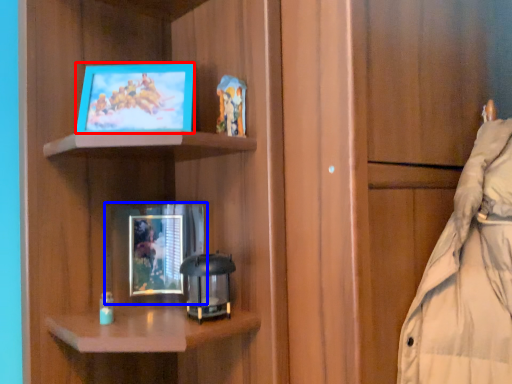
Question: Which point is closer to the camera, picture frame (highlighted by a red box) or picture frame (highlighted by a blue box)?

Choices:
 (A) picture frame
 (B) picture frame

Answer: (A)